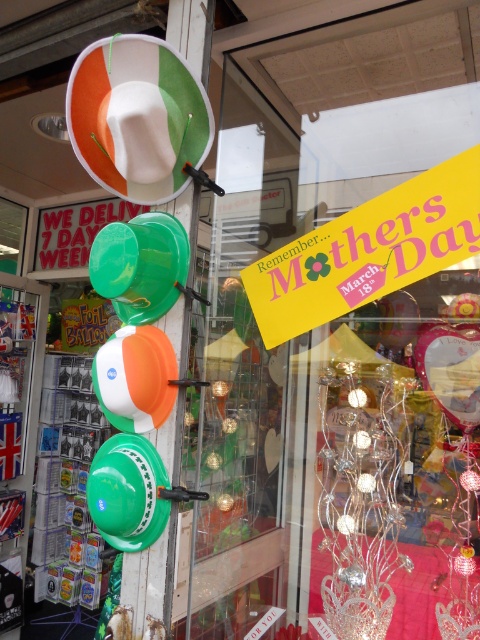
Question: Which object is farther from the camera taking this photo?

Choices:
 (A) green plastic bucket at center
 (B) green matte balloon at left
 (C) orange and white glossy balloon at center

Answer: (C)

Question: Where is white matte balloon at upper center located in relation to green matte balloon at left in the image?

Choices:
 (A) left
 (B) right

Answer: (B)

Question: Among these objects, which one is farthest from the camera?

Choices:
 (A) green plastic bucket at center
 (B) green matte balloon at left

Answer: (A)

Question: Is white matte balloon at upper center closer to the viewer compared to orange and white glossy balloon at center?

Choices:
 (A) no
 (B) yes

Answer: (B)

Question: Which point is farther to the camera?

Choices:
 (A) (164, 212)
 (B) (136, 348)
 (C) (129, 499)

Answer: (A)

Question: Can you confirm if green plastic bucket at center is wider than green matte balloon at left?

Choices:
 (A) yes
 (B) no

Answer: (A)